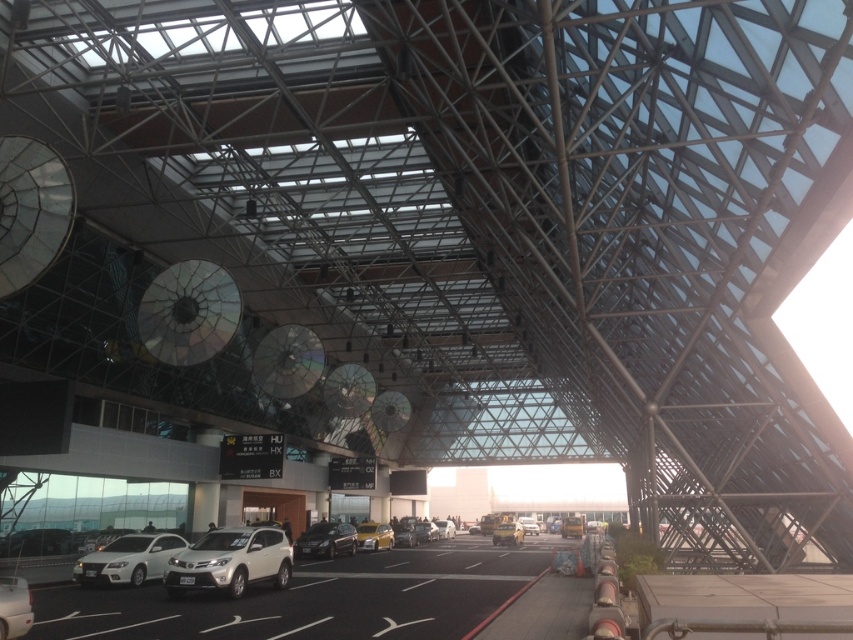
Who is positioned more to the right, metallic silver sedan at center or yellow metallic taxi at center?

yellow metallic taxi at center

Does point (439, 531) lie behind point (525, 522)?

No, (439, 531) is closer to viewer.

Where is `metallic silver sedan at center`? metallic silver sedan at center is located at coordinates (445, 529).

Is yellow metallic car at center positioned behind metallic silver sedan at center?

No, it is in front of metallic silver sedan at center.

Does yellow metallic car at center appear over metallic silver sedan at center?

Yes, yellow metallic car at center is above metallic silver sedan at center.

Does point (357, 536) come closer to viewer compared to point (437, 532)?

Yes, point (357, 536) is closer to viewer.

Where is `yellow metallic car at center`? yellow metallic car at center is located at coordinates (374, 536).

Who is higher up, yellow matte car at center or yellow metallic taxi at center?

yellow matte car at center is above.

Does point (508, 529) lie in front of point (524, 516)?

Yes.

Between point (502, 538) and point (525, 520), which one is positioned in front?

Point (502, 538) is in front.

You are a GUI agent. You are given a task and a screenshot of the screen. Output one action in this format:
    pyautogui.click(x=<x>, y=<y>)
    Task: Click on the yellow matte car at center
    
    Given the screenshot: What is the action you would take?
    pyautogui.click(x=508, y=532)